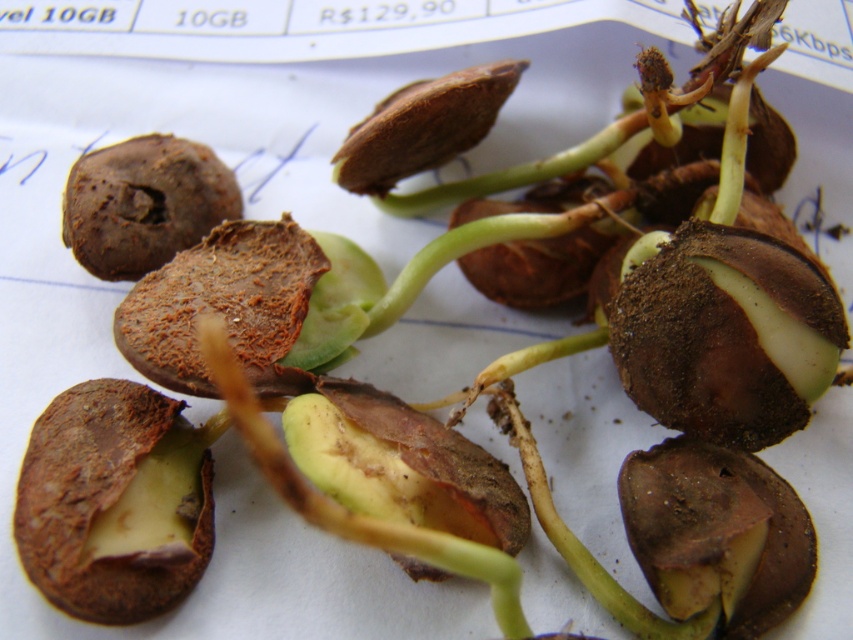
Is brown matte seedling at center-right bigger than brown matte seed at center?

No.

From the picture: Who is positioned more to the right, brown matte seedling at center-right or brown matte seed at center?

From the viewer's perspective, brown matte seedling at center-right appears more on the right side.

Which is behind, point (662, 289) or point (155, 579)?

Point (662, 289)

The image size is (853, 640). I want to click on brown matte seedling at center-right, so click(714, 336).